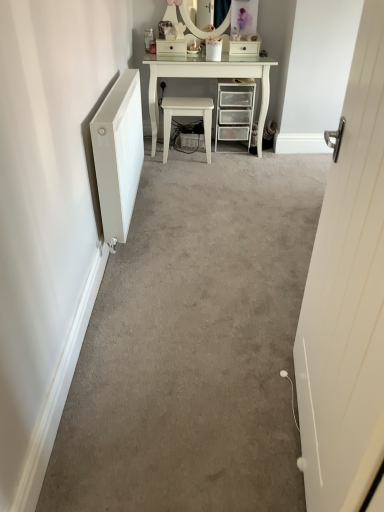
Locate an element on the screen. The height and width of the screenshot is (512, 384). clear plastic drawers at center is located at coordinates (235, 110).

Find the location of a particular element. Image resolution: width=384 pixels, height=512 pixels. white wooden door at right is located at coordinates (347, 298).

You are a GUI agent. You are given a task and a screenshot of the screen. Output one action in this format:
    pyautogui.click(x=<x>, y=<y>)
    Task: Click on the white glossy vanity at upper center
    The height and width of the screenshot is (512, 384).
    Given the screenshot: What is the action you would take?
    pyautogui.click(x=208, y=78)

Find the location of a particular element. This screenshot has width=384, height=512. white glossy drawer at upper center, the 2th drawer viewed from the left is located at coordinates (244, 48).

In the scene shown: Who is bigger, white glossy stool at center or white glossy drawer at upper center, acting as the 1th drawer starting from the left?

white glossy stool at center.

From the image's perspective, does white glossy stool at center appear lower than white glossy drawer at upper center, arranged as the second drawer when viewed from the right?

Yes, from the image's perspective, white glossy stool at center is beneath white glossy drawer at upper center, arranged as the second drawer when viewed from the right.

Identify the location of the 1st drawer behind when counting from the white glossy stool at center. (171, 47).

From a real-world perspective, is white glossy stool at center located beneath white glossy drawer at upper center, arranged as the second drawer when viewed from the right?

Yes, from a real-world perspective, white glossy stool at center is under white glossy drawer at upper center, arranged as the second drawer when viewed from the right.

Would you say white glossy vanity at upper center is to the left or to the right of white glossy drawer at upper center, the 2th drawer viewed from the left, in the picture?

From the image, it's evident that white glossy vanity at upper center is to the left of white glossy drawer at upper center, the 2th drawer viewed from the left.

Is white glossy vanity at upper center oriented away from white glossy drawer at upper center, the 2th drawer viewed from the left?

Absolutely, white glossy vanity at upper center is directed away from white glossy drawer at upper center, the 2th drawer viewed from the left.

Is white glossy vanity at upper center further to the viewer compared to white glossy drawer at upper center, acting as the 1th drawer starting from the right?

No, it is not.

In terms of width, does white glossy vanity at upper center look wider or thinner when compared to white glossy drawer at upper center, the 2th drawer viewed from the left?

white glossy vanity at upper center is wider than white glossy drawer at upper center, the 2th drawer viewed from the left.

Is white glossy drawer at upper center, the 2th drawer viewed from the left, positioned before white glossy drawer at upper center, arranged as the second drawer when viewed from the right?

No, it is behind white glossy drawer at upper center, arranged as the second drawer when viewed from the right.

Is white glossy drawer at upper center, the 2th drawer viewed from the left, facing away from white glossy drawer at upper center, acting as the 1th drawer starting from the left?

That's not correct — white glossy drawer at upper center, the 2th drawer viewed from the left, is not looking away from white glossy drawer at upper center, acting as the 1th drawer starting from the left.

In the scene shown: Is white glossy drawer at upper center, acting as the 1th drawer starting from the right, wider or thinner than white glossy drawer at upper center, acting as the 1th drawer starting from the left?

white glossy drawer at upper center, acting as the 1th drawer starting from the right, is wider than white glossy drawer at upper center, acting as the 1th drawer starting from the left.

This screenshot has width=384, height=512. Find the location of `drawer located on the right of white glossy drawer at upper center, arranged as the second drawer when viewed from the right`. drawer located on the right of white glossy drawer at upper center, arranged as the second drawer when viewed from the right is located at coordinates (244, 48).

From the image's perspective, which is below, white glossy drawer at upper center, acting as the 1th drawer starting from the left, or white glossy stool at center?

white glossy stool at center appears lower in the image.

Which is behind, point (165, 40) or point (204, 112)?

The point (165, 40) is more distant.

How different are the orientations of white glossy drawer at upper center, arranged as the second drawer when viewed from the right, and white glossy stool at center in degrees?

The facing directions of white glossy drawer at upper center, arranged as the second drawer when viewed from the right, and white glossy stool at center are 175 degrees apart.

Between white glossy drawer at upper center, arranged as the second drawer when viewed from the right, and white glossy stool at center, which one has larger width?

white glossy stool at center is wider.

Between white glossy drawer at upper center, acting as the 1th drawer starting from the left, and white glossy drawer at upper center, acting as the 1th drawer starting from the right, which one appears on the right side from the viewer's perspective?

white glossy drawer at upper center, acting as the 1th drawer starting from the right.

Considering the relative sizes of white glossy drawer at upper center, acting as the 1th drawer starting from the left, and white glossy drawer at upper center, acting as the 1th drawer starting from the right, in the image provided, is white glossy drawer at upper center, acting as the 1th drawer starting from the left, thinner than white glossy drawer at upper center, acting as the 1th drawer starting from the right,?

Yes, white glossy drawer at upper center, acting as the 1th drawer starting from the left, is thinner than white glossy drawer at upper center, acting as the 1th drawer starting from the right.

Between white glossy drawer at upper center, acting as the 1th drawer starting from the left, and white glossy drawer at upper center, the 2th drawer viewed from the left, which one is positioned behind?

white glossy drawer at upper center, the 2th drawer viewed from the left, is further away from the camera.

Who is shorter, white glossy drawer at upper center, arranged as the second drawer when viewed from the right, or white glossy drawer at upper center, the 2th drawer viewed from the left?

white glossy drawer at upper center, the 2th drawer viewed from the left.

From a real-world perspective, is white glossy stool at center located beneath white glossy vanity at upper center?

Correct, in the physical world, white glossy stool at center is lower than white glossy vanity at upper center.

Can you confirm if white glossy stool at center is wider than white glossy vanity at upper center?

No, white glossy stool at center is not wider than white glossy vanity at upper center.

From the image's perspective, which is below, white glossy stool at center or white glossy vanity at upper center?

white glossy stool at center, from the image's perspective.

Are white glossy stool at center and white glossy vanity at upper center far apart?

That's not correct — white glossy stool at center is a little close to white glossy vanity at upper center.

Could you tell me if clear plastic drawers at center is turned towards white glossy drawer at upper center, the 2th drawer viewed from the left?

No, clear plastic drawers at center does not turn towards white glossy drawer at upper center, the 2th drawer viewed from the left.

Does point (240, 126) appear closer or farther from the camera than point (256, 54)?

Point (240, 126) is farther from the camera than point (256, 54).

Find the location of `the 2nd drawer behind when counting from the clear plastic drawers at center`. the 2nd drawer behind when counting from the clear plastic drawers at center is located at coordinates (244, 48).

How many degrees apart are the facing directions of clear plastic drawers at center and white glossy drawer at upper center, the 2th drawer viewed from the left?

They differ by 1.98 degrees in their facing directions.

Which drawer is the 1st one when counting from the back of the white glossy stool at center? Please provide its 2D coordinates.

[(171, 47)]

Locate an element on the screen. Image resolution: width=384 pixels, height=512 pixels. drawer on the right of white glossy vanity at upper center is located at coordinates (244, 48).

Considering their positions, is white glossy drawer at upper center, acting as the 1th drawer starting from the right, positioned closer to white glossy drawer at upper center, arranged as the second drawer when viewed from the right, than white wooden door at right?

white glossy drawer at upper center, acting as the 1th drawer starting from the right, is positioned closer to the anchor white glossy drawer at upper center, arranged as the second drawer when viewed from the right.

Based on their spatial positions, is white glossy vanity at upper center or white glossy drawer at upper center, acting as the 1th drawer starting from the right, further from white wooden door at right?

Among the two, white glossy drawer at upper center, acting as the 1th drawer starting from the right, is located further to white wooden door at right.

When comparing their distances from white glossy stool at center, does white glossy drawer at upper center, acting as the 1th drawer starting from the right, or clear plastic drawers at center seem further?

white glossy drawer at upper center, acting as the 1th drawer starting from the right, is further to white glossy stool at center.

Estimate the real-world distances between objects in this image. Which object is closer to white glossy drawer at upper center, arranged as the second drawer when viewed from the right, white glossy vanity at upper center or clear plastic drawers at center?

Among the two, white glossy vanity at upper center is located nearer to white glossy drawer at upper center, arranged as the second drawer when viewed from the right.

Considering their positions, is white glossy drawer at upper center, arranged as the second drawer when viewed from the right, positioned further to white glossy vanity at upper center than white glossy stool at center?

Among the two, white glossy drawer at upper center, arranged as the second drawer when viewed from the right, is located further to white glossy vanity at upper center.

From the image, which object appears to be nearer to white glossy stool at center, white glossy vanity at upper center or white wooden door at right?

white glossy vanity at upper center is positioned closer to the anchor white glossy stool at center.

From the image, which object appears to be farther from white wooden door at right, clear plastic drawers at center or white glossy vanity at upper center?

clear plastic drawers at center is positioned further to the anchor white wooden door at right.

Based on their spatial positions, is white glossy drawer at upper center, the 2th drawer viewed from the left, or white glossy drawer at upper center, arranged as the second drawer when viewed from the right, further from white wooden door at right?

white glossy drawer at upper center, the 2th drawer viewed from the left.

You are a GUI agent. You are given a task and a screenshot of the screen. Output one action in this format:
    pyautogui.click(x=<x>, y=<y>)
    Task: Click on the table located between white wooden door at right and white glossy drawer at upper center, arranged as the second drawer when viewed from the right, in the depth direction
    The width and height of the screenshot is (384, 512).
    Given the screenshot: What is the action you would take?
    pyautogui.click(x=208, y=78)

Find the location of `stool between white wooden door at right and white glossy drawer at upper center, arranged as the second drawer when viewed from the right, from front to back`. stool between white wooden door at right and white glossy drawer at upper center, arranged as the second drawer when viewed from the right, from front to back is located at coordinates (188, 116).

Find the location of a particular element. The image size is (384, 512). chest of drawers between white glossy drawer at upper center, the 2th drawer viewed from the left, and white glossy stool at center from top to bottom is located at coordinates (235, 110).

Image resolution: width=384 pixels, height=512 pixels. I want to click on table between white wooden door at right and clear plastic drawers at center in the front-back direction, so click(208, 78).